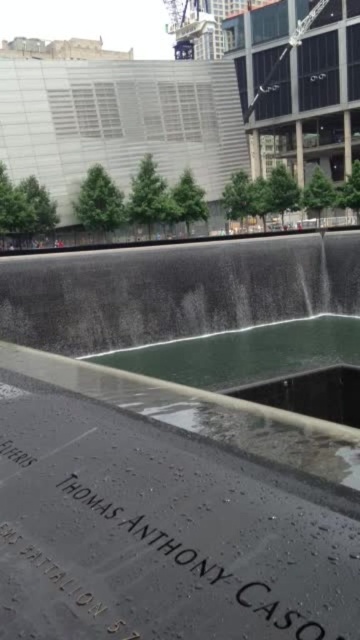
You are standing at the 911 Memorial and see the green polished stone fountain at center and the black polished stone at center. Which one is higher in position?

The green polished stone fountain at center is above the black polished stone at center, so it is higher in position.

Consider the image. You are standing at the edge of the reflecting pool and want to find the green polished stone fountain at center. According to the coordinates provided, in which direction should you look relative to your current position?

The green polished stone fountain at center is located at coordinates point (176, 445), which means you should look towards the center area of the scene from your current position at the edge of the reflecting pool.